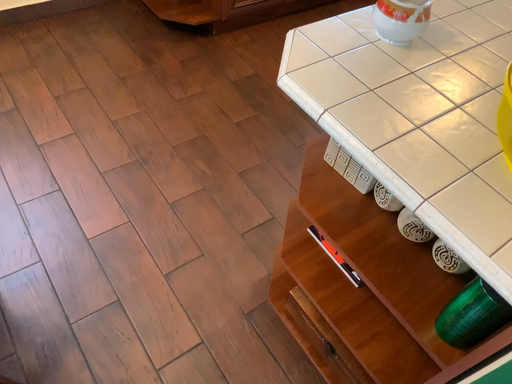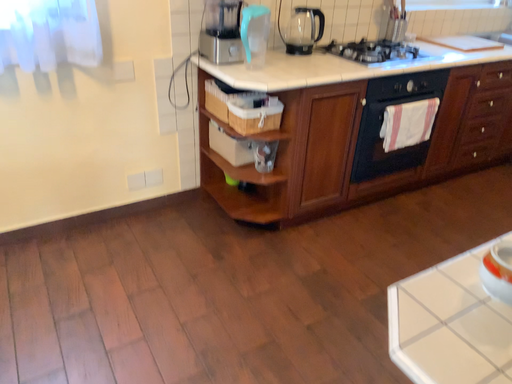
Question: How did the camera likely rotate when shooting the video?

Choices:
 (A) rotated upward
 (B) rotated downward

Answer: (A)